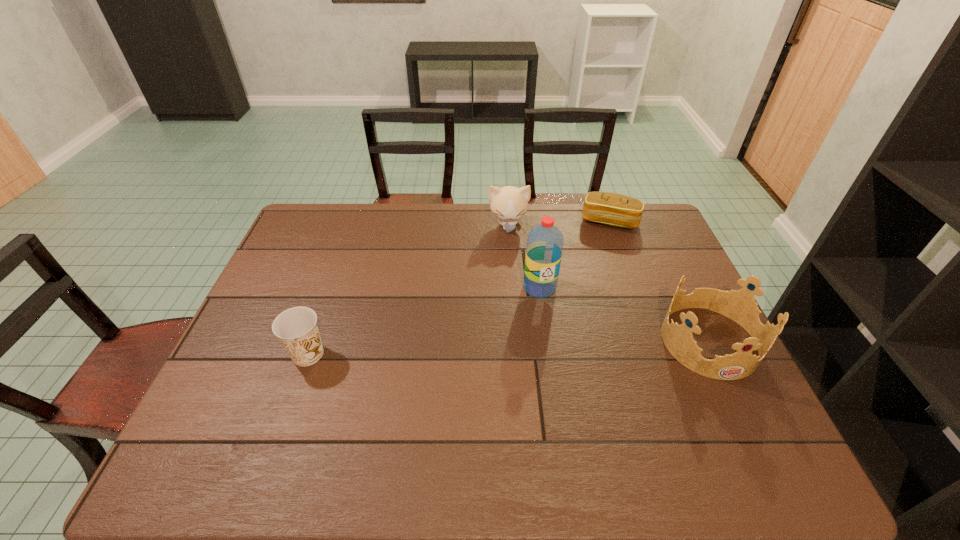
At what (x,y) coordinates should I click in order to perform the action: click on free space on the desktop that is between the leftmost object and the tiara and is positioned on the zipper side of the shortest object. Please return your answer as a coordinate pair (x, y). The width and height of the screenshot is (960, 540). Looking at the image, I should click on pos(566,346).

Locate an element on the screen. This screenshot has width=960, height=540. vacant space on the desktop that is between the Dixie cup and the tiara and is positioned on the front label of the water bottle is located at coordinates (547, 346).

This screenshot has width=960, height=540. Find the location of `free space on the desktop that is between the second shortest object and the tiara and is positioned on the face of the kitten`. free space on the desktop that is between the second shortest object and the tiara and is positioned on the face of the kitten is located at coordinates (520, 347).